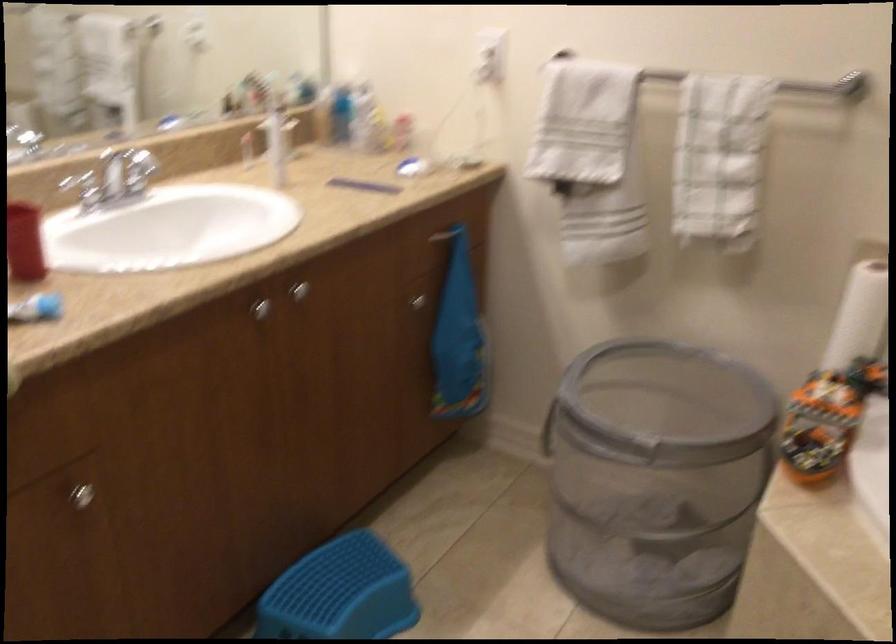
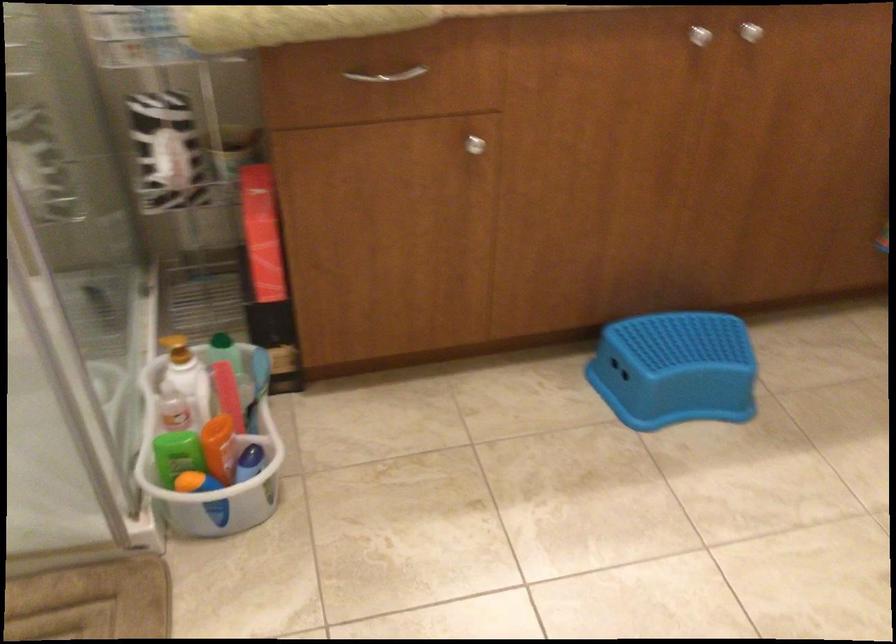
In the second image, find the point that corresponds to (x=291, y=288) in the first image.

(751, 32)